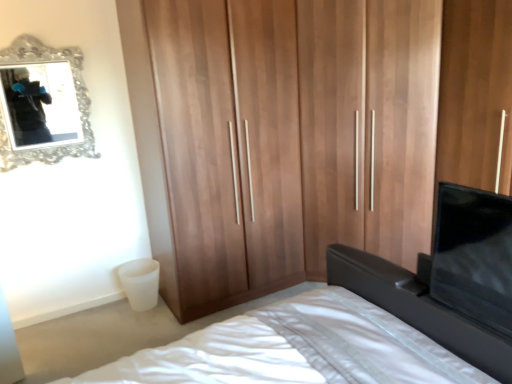
Question: From the image's perspective, is wooden wardrobe at center on top of matte black vanity at lower right?

Choices:
 (A) no
 (B) yes

Answer: (B)

Question: Considering the relative sizes of wooden wardrobe at center and matte black vanity at lower right in the image provided, is wooden wardrobe at center thinner than matte black vanity at lower right?

Choices:
 (A) yes
 (B) no

Answer: (B)

Question: Can you confirm if wooden wardrobe at center is positioned to the right of matte black vanity at lower right?

Choices:
 (A) yes
 (B) no

Answer: (B)

Question: Would you say wooden wardrobe at center is a long distance from matte black vanity at lower right?

Choices:
 (A) yes
 (B) no

Answer: (A)

Question: From a real-world perspective, is wooden wardrobe at center over matte black vanity at lower right?

Choices:
 (A) yes
 (B) no

Answer: (A)

Question: In terms of size, does white fabric bed at center appear bigger or smaller than wooden wardrobe at center?

Choices:
 (A) small
 (B) big

Answer: (A)

Question: Is white fabric bed at center inside the boundaries of wooden wardrobe at center, or outside?

Choices:
 (A) outside
 (B) inside

Answer: (A)

Question: Considering the relative positions of white fabric bed at center and wooden wardrobe at center in the image provided, is white fabric bed at center to the left or to the right of wooden wardrobe at center?

Choices:
 (A) right
 (B) left

Answer: (B)

Question: Relative to wooden wardrobe at center, is white fabric bed at center in front or behind?

Choices:
 (A) front
 (B) behind

Answer: (A)

Question: Considering their positions, is wooden wardrobe at center located in front of or behind white fabric bed at center?

Choices:
 (A) behind
 (B) front

Answer: (A)

Question: From the image's perspective, is wooden wardrobe at center positioned above or below white fabric bed at center?

Choices:
 (A) above
 (B) below

Answer: (A)

Question: From a real-world perspective, relative to white fabric bed at center, is wooden wardrobe at center vertically above or below?

Choices:
 (A) above
 (B) below

Answer: (A)

Question: Looking at their shapes, would you say wooden wardrobe at center is wider or thinner than white fabric bed at center?

Choices:
 (A) thin
 (B) wide

Answer: (A)

Question: From the image's perspective, is wooden wardrobe at center positioned above or below matte black vanity at lower right?

Choices:
 (A) above
 (B) below

Answer: (A)

Question: From a real-world perspective, is wooden wardrobe at center physically located above or below matte black vanity at lower right?

Choices:
 (A) above
 (B) below

Answer: (A)